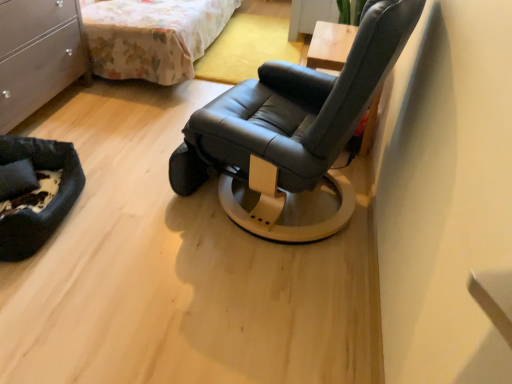
Question: From the image's perspective, is black leather chair at center below floral fabric bed at upper left?

Choices:
 (A) no
 (B) yes

Answer: (B)

Question: Is black leather chair at center located outside floral fabric bed at upper left?

Choices:
 (A) yes
 (B) no

Answer: (A)

Question: Is black leather chair at center oriented towards floral fabric bed at upper left?

Choices:
 (A) yes
 (B) no

Answer: (B)

Question: Is black leather chair at center smaller than floral fabric bed at upper left?

Choices:
 (A) no
 (B) yes

Answer: (B)

Question: Does black leather chair at center have a lesser width compared to floral fabric bed at upper left?

Choices:
 (A) yes
 (B) no

Answer: (A)

Question: Does black leather chair at center have a greater height compared to floral fabric bed at upper left?

Choices:
 (A) no
 (B) yes

Answer: (B)

Question: Is black leather chair at center thinner than black fabric pillow at lower left?

Choices:
 (A) no
 (B) yes

Answer: (A)

Question: Is black leather chair at center further to camera compared to black fabric pillow at lower left?

Choices:
 (A) no
 (B) yes

Answer: (A)

Question: Could you tell me if black leather chair at center is facing black fabric pillow at lower left?

Choices:
 (A) yes
 (B) no

Answer: (B)

Question: Can you confirm if black leather chair at center is positioned to the right of black fabric pillow at lower left?

Choices:
 (A) yes
 (B) no

Answer: (A)

Question: From a real-world perspective, is black leather chair at center physically above black fabric pillow at lower left?

Choices:
 (A) yes
 (B) no

Answer: (A)

Question: From a real-world perspective, does black leather chair at center sit lower than black fabric pillow at lower left?

Choices:
 (A) yes
 (B) no

Answer: (B)

Question: Are floral fabric bed at upper left and black leather chair at center located far from each other?

Choices:
 (A) no
 (B) yes

Answer: (B)